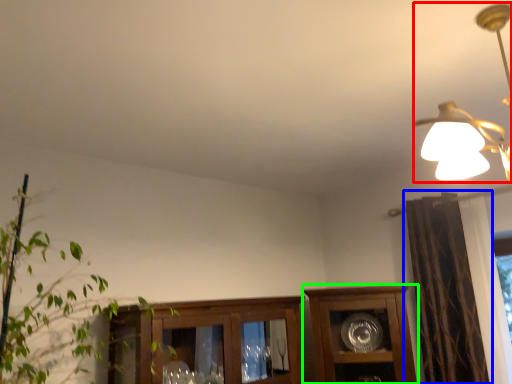
Question: Considering the real-world distances, which object is closest to lamp (highlighted by a red box)? curtain (highlighted by a blue box) or cabinetry (highlighted by a green box).

Choices:
 (A) curtain
 (B) cabinetry

Answer: (A)